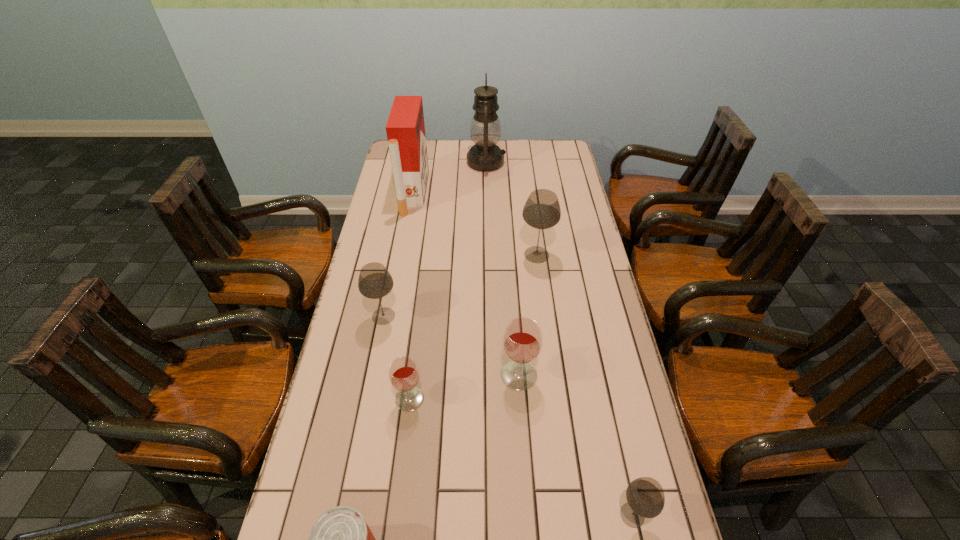
The width and height of the screenshot is (960, 540). In order to click on oil lamp in this screenshot , I will do `click(485, 155)`.

Identify the location of the seventh shortest object. The height and width of the screenshot is (540, 960). (405, 128).

This screenshot has height=540, width=960. I want to click on red cigarette case, so click(405, 128).

At what (x,y) coordinates should I click in order to perform the action: click on the sixth nearest object. Please return your answer as a coordinate pair (x, y). Looking at the image, I should click on (542, 210).

At what (x,y) coordinates should I click in order to perform the action: click on the tallest wineglass. Please return your answer as a coordinate pair (x, y). Looking at the image, I should click on (542, 210).

The width and height of the screenshot is (960, 540). Identify the location of the right red wineglass. (522, 341).

Locate an element on the screen. the leftmost gray wineglass is located at coordinates (374, 282).

At what (x,y) coordinates should I click in order to perform the action: click on the second farthest gray wineglass. Please return your answer as a coordinate pair (x, y). The height and width of the screenshot is (540, 960). Looking at the image, I should click on (374, 282).

The height and width of the screenshot is (540, 960). I want to click on the left red wineglass, so click(404, 375).

The height and width of the screenshot is (540, 960). Identify the location of the smaller red wineglass. (404, 375).